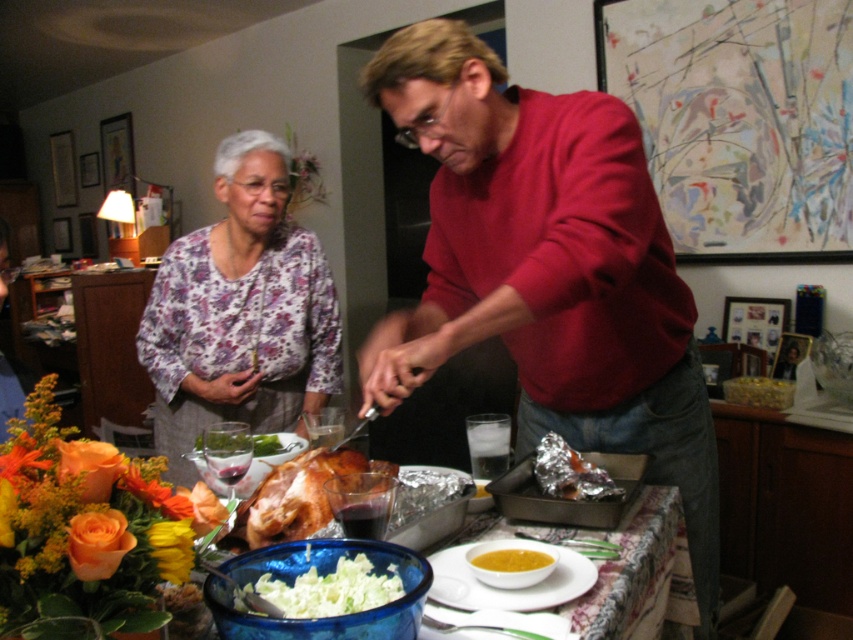
Question: Does shiny silver turkey at center come in front of yellow creamy soup at center?

Choices:
 (A) yes
 (B) no

Answer: (A)

Question: Which object is the closest to the white matte shredded cabbage at center?

Choices:
 (A) white ceramic bowl at center
 (B) shiny silver turkey at center
 (C) green leafy vegetable at center
 (D) yellow matte soup bowl at center

Answer: (A)

Question: Does yellow matte soup bowl at center have a lesser width compared to yellow creamy soup at center?

Choices:
 (A) no
 (B) yes

Answer: (A)

Question: Does red matte sweater at center have a greater width compared to golden brown roasted turkey at center?

Choices:
 (A) no
 (B) yes

Answer: (B)

Question: Among these objects, which one is farthest from the camera?

Choices:
 (A) red matte sweater at center
 (B) silver foil wrapped food at center

Answer: (B)

Question: Which object is the farthest from the golden brown roasted turkey at center?

Choices:
 (A) shiny silver turkey at center
 (B) red matte sweater at center
 (C) green leafy vegetable at center
 (D) white ceramic bowl at center

Answer: (B)